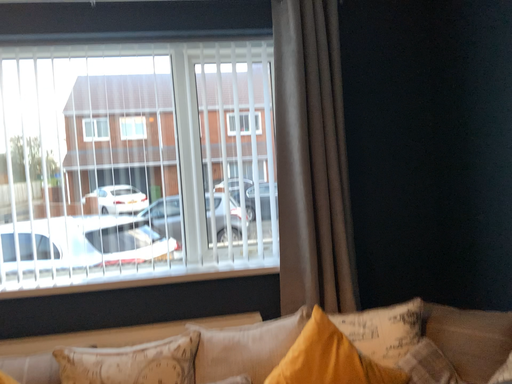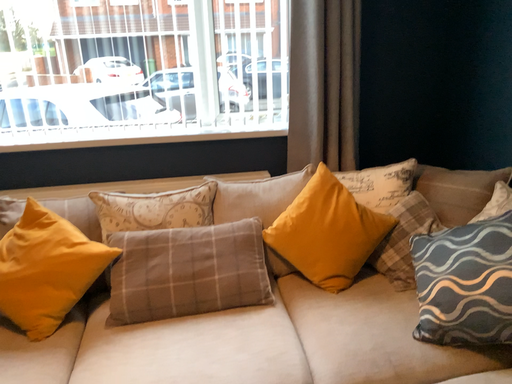
Question: How did the camera likely rotate when shooting the video?

Choices:
 (A) rotated upward
 (B) rotated downward

Answer: (B)